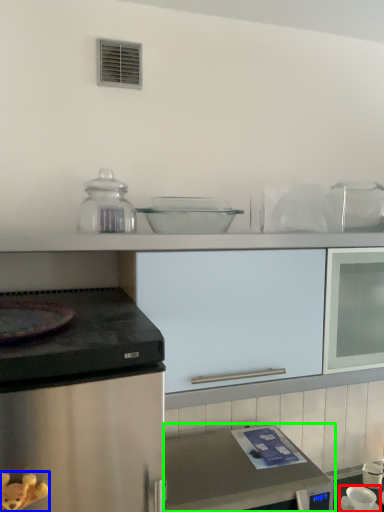
Question: Which object is the farthest from appliance (highlighted by a red box)? Choose among these: toy (highlighted by a blue box) or home appliance (highlighted by a green box).

Choices:
 (A) toy
 (B) home appliance

Answer: (A)